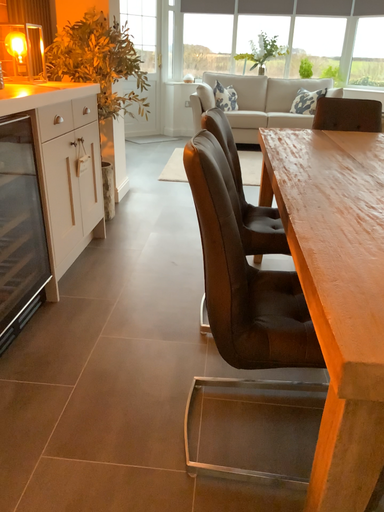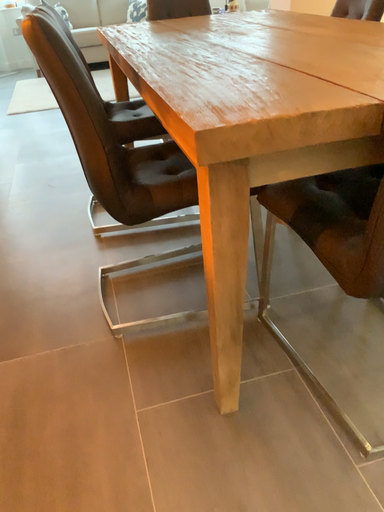
Question: How did the camera likely rotate when shooting the video?

Choices:
 (A) rotated downward
 (B) rotated upward

Answer: (A)